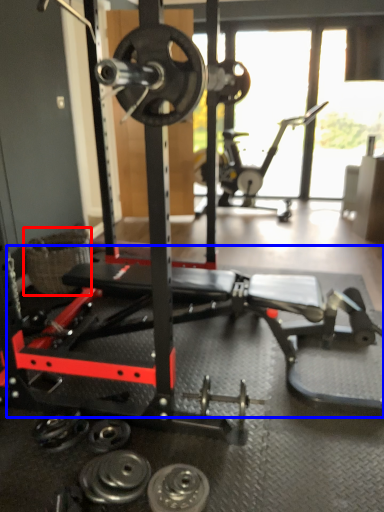
Question: Which object appears farthest to the camera in this image, basket (highlighted by a red box) or training bench (highlighted by a blue box)?

Choices:
 (A) basket
 (B) training bench

Answer: (A)